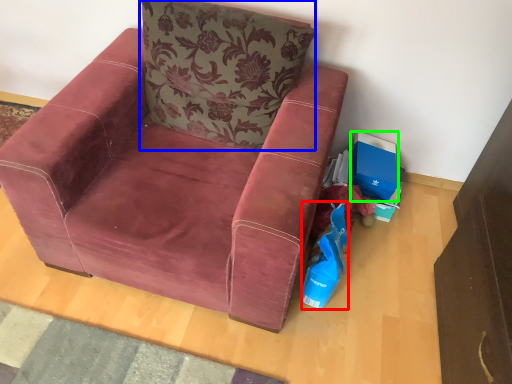
Question: Which object is positioned closest to shopping bag (highlighted by a red box)? Select from pillow (highlighted by a blue box) and storage box (highlighted by a green box).

Choices:
 (A) pillow
 (B) storage box

Answer: (B)